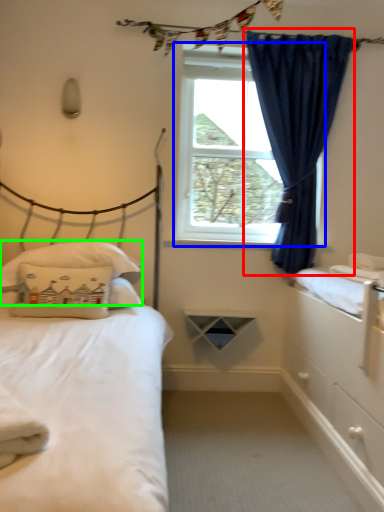
Question: Considering the real-world distances, which object is farthest from curtain (highlighted by a red box)? window screen (highlighted by a blue box) or pillow (highlighted by a green box)?

Choices:
 (A) window screen
 (B) pillow

Answer: (B)